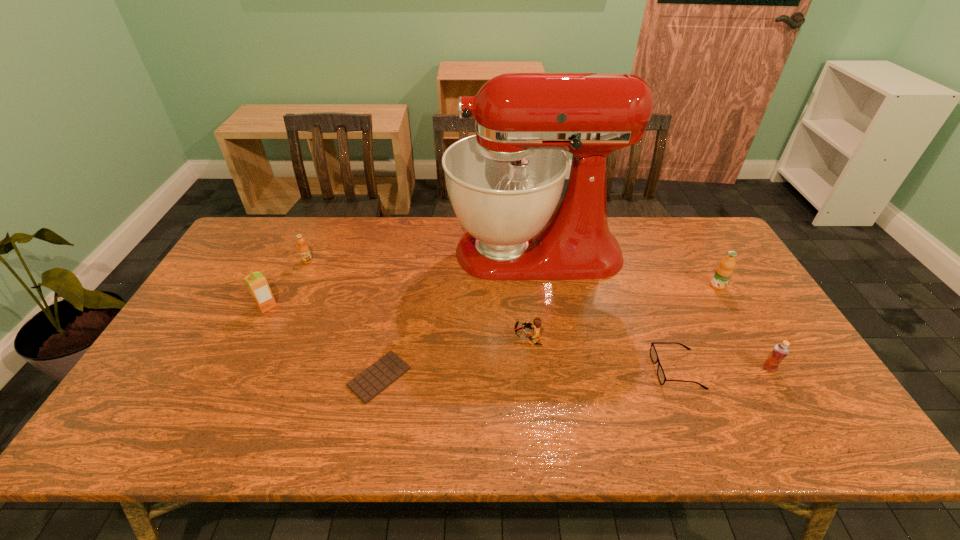
The image size is (960, 540). Find the location of `vacant area that lies between the nearest orange juice and the sixth tallest object`. vacant area that lies between the nearest orange juice and the sixth tallest object is located at coordinates (648, 353).

Where is `unoccupied area between the nearest orange juice and the Lego`? unoccupied area between the nearest orange juice and the Lego is located at coordinates tap(648, 353).

The image size is (960, 540). What are the coordinates of `vacant space in between the spectacles and the leftmost object` in the screenshot? It's located at (471, 338).

Where is `empty space that is in between the nearest orange juice and the spectacles`? This screenshot has height=540, width=960. empty space that is in between the nearest orange juice and the spectacles is located at coordinates (723, 369).

This screenshot has width=960, height=540. In order to click on free space between the leftmost orange juice and the second orange juice from left to right in this screenshot , I will do `click(287, 284)`.

Find the location of a particular element. This screenshot has height=540, width=960. free spot between the nearest orange juice and the seventh tallest object is located at coordinates (723, 369).

You are a GUI agent. You are given a task and a screenshot of the screen. Output one action in this format:
    pyautogui.click(x=<x>, y=<y>)
    Task: Click on the free spot between the Lego and the sixth object from right to left
    
    Given the screenshot: What is the action you would take?
    pyautogui.click(x=453, y=358)

The image size is (960, 540). I want to click on free space between the second farthest orange juice and the leftmost object, so click(492, 296).

Where is `free space between the mixer and the sixth tallest object`? The height and width of the screenshot is (540, 960). free space between the mixer and the sixth tallest object is located at coordinates (531, 295).

Select which object is the third closest to the sixth object from right to left. Please provide its 2D coordinates. Your answer should be formatted as a tuple, i.e. [(x, y)], where the tuple contains the x and y coordinates of a point satisfying the conditions above.

[(256, 282)]